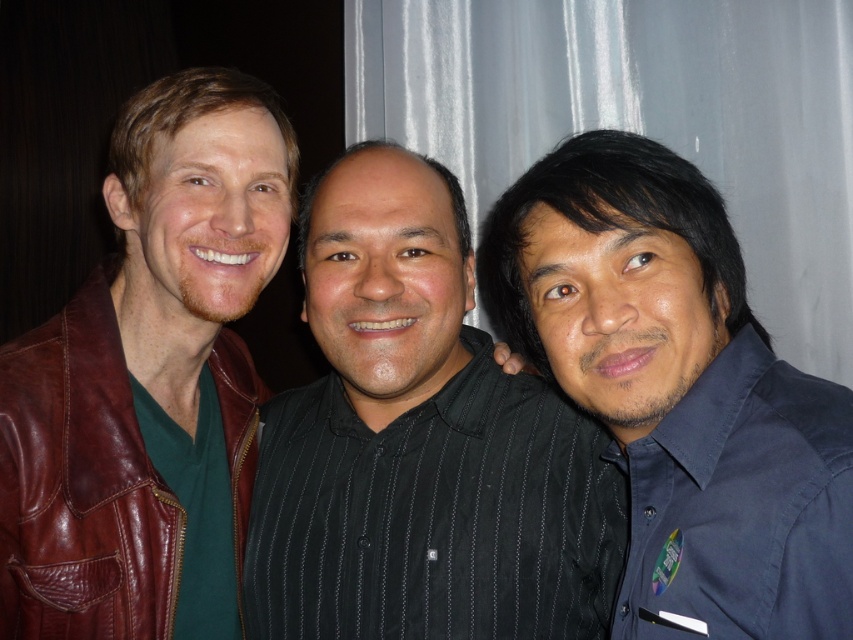
Question: Is black striped shirt at center closer to the viewer compared to dark blue shirt at right?

Choices:
 (A) no
 (B) yes

Answer: (A)

Question: Which point is closer to the camera taking this photo?

Choices:
 (A) (381, 145)
 (B) (775, 428)

Answer: (B)

Question: Among these objects, which one is farthest from the camera?

Choices:
 (A) brown leather jacket at left
 (B) dark blue shirt at right

Answer: (A)

Question: Which of the following is the closest to the observer?

Choices:
 (A) (332, 625)
 (B) (77, 515)

Answer: (B)

Question: Can you confirm if black striped shirt at center is bigger than dark blue shirt at right?

Choices:
 (A) yes
 (B) no

Answer: (A)

Question: Is black striped shirt at center smaller than dark blue shirt at right?

Choices:
 (A) yes
 (B) no

Answer: (B)